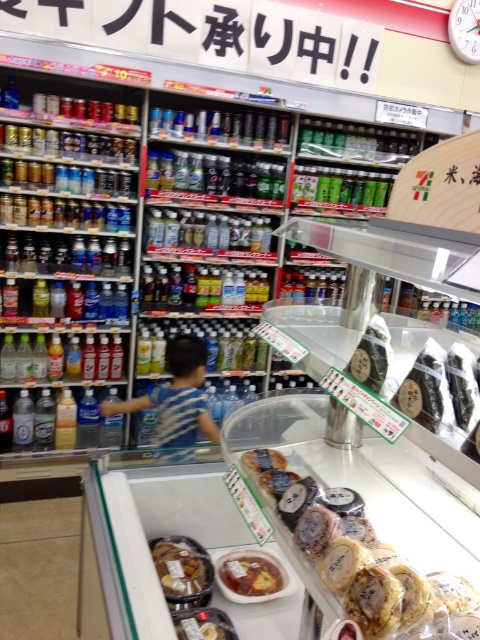
Question: Is smooth yellow cake at center positioned behind shiny plastic container at center?

Choices:
 (A) no
 (B) yes

Answer: (A)

Question: Is translucent plastic containers at center positioned at the back of smooth brown pastry at center?

Choices:
 (A) yes
 (B) no

Answer: (B)

Question: Which of the following is the closest to the observer?

Choices:
 (A) golden brown cookie at center
 (B) translucent plastic containers at center
 (C) smooth yellow cake at center

Answer: (B)

Question: Which object is farther from the camera taking this photo?

Choices:
 (A) shiny plastic container at center
 (B) translucent plastic containers at center
 (C) smooth brown pastry at center
 (D) golden brown cookie at center

Answer: (C)

Question: Is translucent plastic containers at center bigger than smooth brown pastry at center?

Choices:
 (A) no
 (B) yes

Answer: (B)

Question: Among these objects, which one is farthest from the camera?

Choices:
 (A) smooth brown pastry at center
 (B) shiny plastic container at center
 (C) smooth yellow cake at center

Answer: (A)